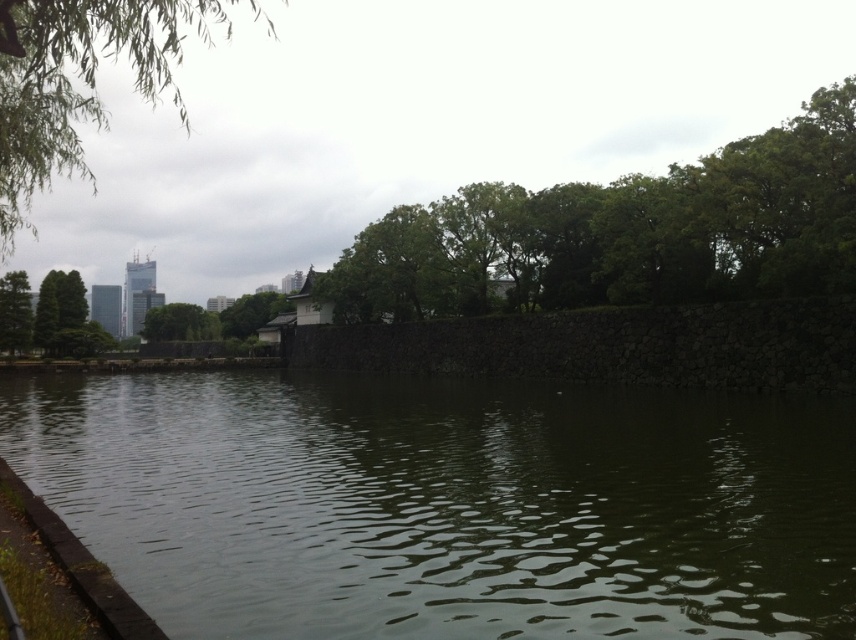
Who is higher up, green leafy tree at center or green leafy tree at left?

green leafy tree at left is higher up.

Which is in front, point (217, 332) or point (33, 317)?

Point (33, 317) is more forward.

Identify the location of green leafy tree at center. (179, 323).

Does greenish water at center appear under green leafy tree at center?

Yes.

Is greenish water at center thinner than green leafy tree at center?

Incorrect, greenish water at center's width is not less than green leafy tree at center's.

Is point (765, 544) positioned behind point (209, 337)?

No, (765, 544) is in front of (209, 337).

At what (x,y) coordinates should I click in order to perform the action: click on greenish water at center. Please return your answer as a coordinate pair (x, y). The width and height of the screenshot is (856, 640). Looking at the image, I should click on (449, 504).

Who is positioned more to the left, green leafy tree at upper left or green leafy tree at center?

Positioned to the left is green leafy tree at center.

Which of these two, green leafy tree at upper left or green leafy tree at center, stands taller?

With more height is green leafy tree at upper left.

Between point (84, 51) and point (201, 336), which one is positioned behind?

Positioned behind is point (201, 336).

Find the location of a particular element. This screenshot has height=640, width=856. green leafy tree at upper left is located at coordinates (84, 80).